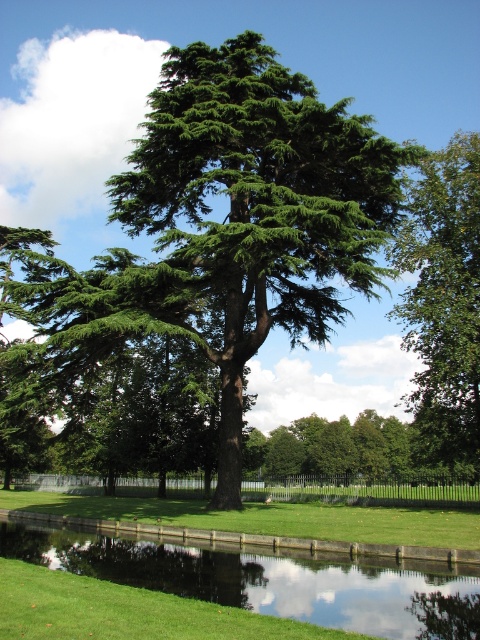
In the scene shown: You are standing at the point marked as point (271, 577) in the image. What do you see directly beneath your feet?

You see green grass at lower center directly beneath your feet at point (271, 577).